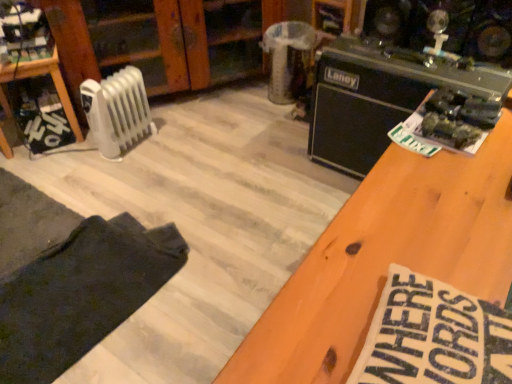
Question: Does dark cotton pants at lower left have a lesser width compared to wooden shelf at left?

Choices:
 (A) no
 (B) yes

Answer: (A)

Question: Considering the relative sizes of dark cotton pants at lower left and wooden shelf at left in the image provided, is dark cotton pants at lower left taller than wooden shelf at left?

Choices:
 (A) yes
 (B) no

Answer: (B)

Question: Is the surface of dark cotton pants at lower left in direct contact with wooden shelf at left?

Choices:
 (A) yes
 (B) no

Answer: (B)

Question: From the image's perspective, is dark cotton pants at lower left located above wooden shelf at left?

Choices:
 (A) yes
 (B) no

Answer: (B)

Question: Is dark cotton pants at lower left further to the viewer compared to wooden shelf at left?

Choices:
 (A) yes
 (B) no

Answer: (B)

Question: Is point (210, 16) closer or farther from the camera than point (44, 61)?

Choices:
 (A) closer
 (B) farther

Answer: (B)

Question: Considering their positions, is white plastic radiator at left located in front of or behind wooden shelf at left?

Choices:
 (A) front
 (B) behind

Answer: (B)

Question: Considering the positions of white plastic radiator at left and wooden shelf at left in the image, is white plastic radiator at left taller or shorter than wooden shelf at left?

Choices:
 (A) tall
 (B) short

Answer: (A)

Question: Looking at the image, does white plastic radiator at left seem bigger or smaller compared to wooden shelf at left?

Choices:
 (A) small
 (B) big

Answer: (B)

Question: Considering the positions of wooden shelf at left and black matte amplifier at upper right in the image, is wooden shelf at left taller or shorter than black matte amplifier at upper right?

Choices:
 (A) short
 (B) tall

Answer: (A)

Question: Considering their positions, is wooden shelf at left located in front of or behind black matte amplifier at upper right?

Choices:
 (A) front
 (B) behind

Answer: (B)

Question: Looking at the image, does wooden shelf at left seem bigger or smaller compared to black matte amplifier at upper right?

Choices:
 (A) big
 (B) small

Answer: (B)

Question: Considering the positions of point (1, 139) and point (407, 107), is point (1, 139) closer or farther from the camera than point (407, 107)?

Choices:
 (A) closer
 (B) farther

Answer: (B)

Question: In terms of width, does dark cotton pants at lower left look wider or thinner when compared to white plastic radiator at left?

Choices:
 (A) wide
 (B) thin

Answer: (A)

Question: Is point (30, 322) positioned closer to the camera than point (138, 127)?

Choices:
 (A) closer
 (B) farther

Answer: (A)